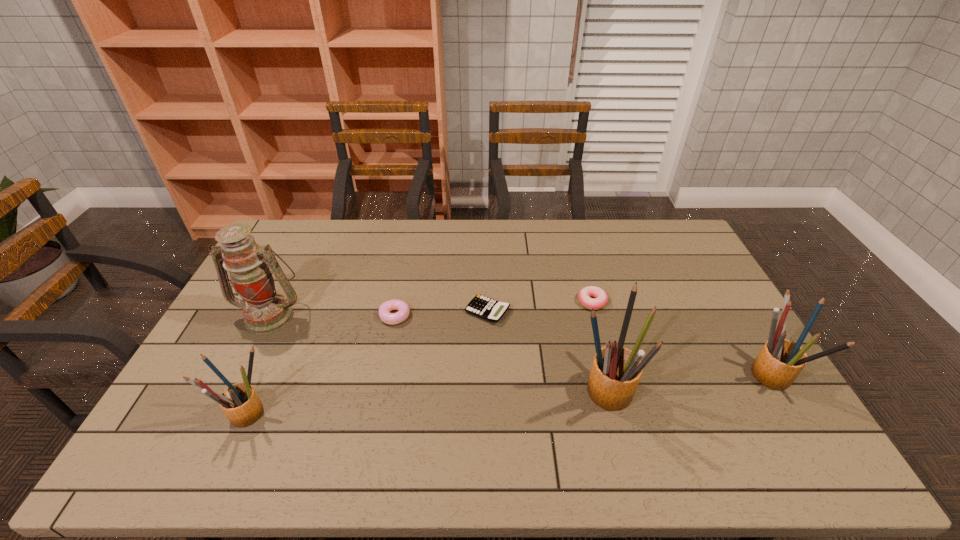
This screenshot has width=960, height=540. I want to click on vacant region that satisfies the following two spatial constraints: 1. on the back side of the leftmost pencil box; 2. on the right side of the shortest object, so click(291, 311).

This screenshot has height=540, width=960. I want to click on vacant area that satisfies the following two spatial constraints: 1. on the back side of the third object from left to right; 2. on the right side of the shortest pencil box, so click(x=289, y=316).